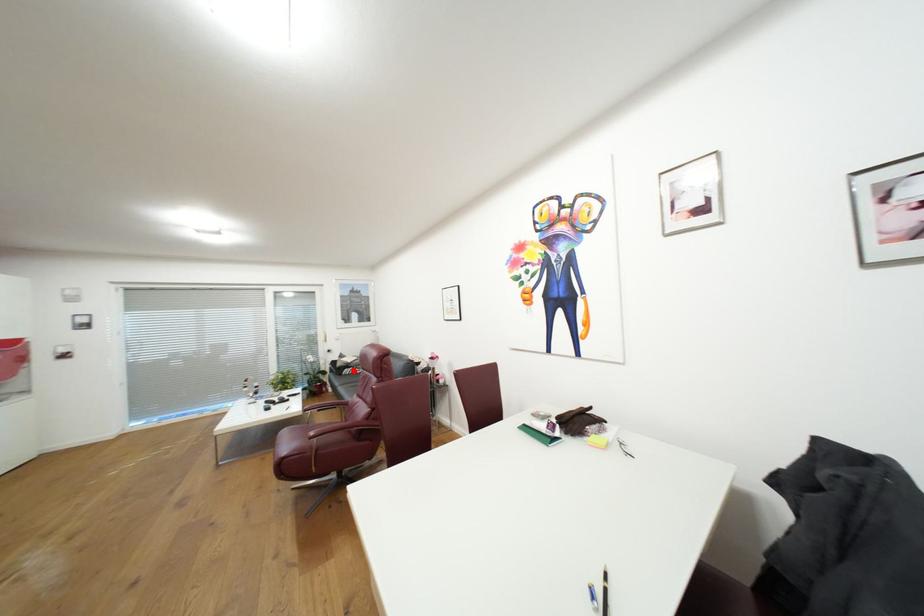
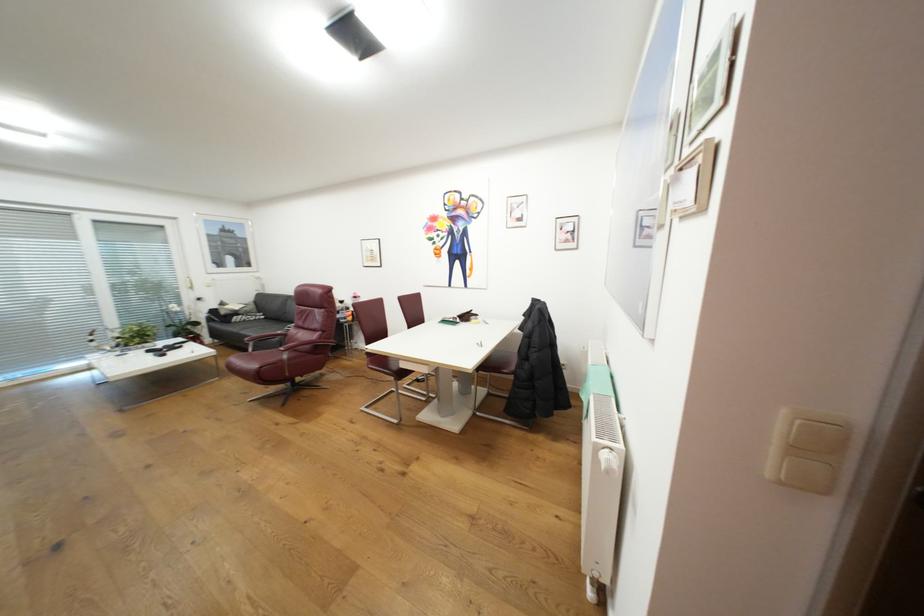
In the second image, find the point that corresponds to the highlighted location in the first image.

(244, 318)